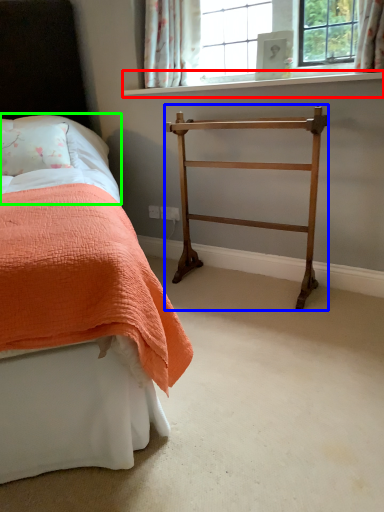
Question: Based on their relative distances, which object is farther from window sill (highlighted by a red box)? Choose from furniture (highlighted by a blue box) and sheet (highlighted by a green box).

Choices:
 (A) furniture
 (B) sheet

Answer: (B)